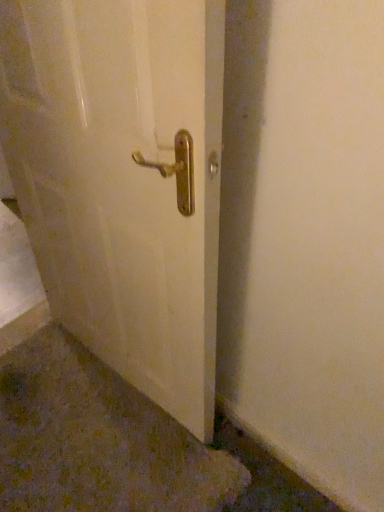
Where is `white glossy door handle at center`? The height and width of the screenshot is (512, 384). white glossy door handle at center is located at coordinates (123, 180).

Describe the element at coordinates (123, 180) in the screenshot. The width and height of the screenshot is (384, 512). I see `white glossy door handle at center` at that location.

Looking at this image, what is the approximate height of white glossy door handle at center?

white glossy door handle at center is 1.20 meters tall.

The image size is (384, 512). Identify the location of white glossy door handle at center. (123, 180).